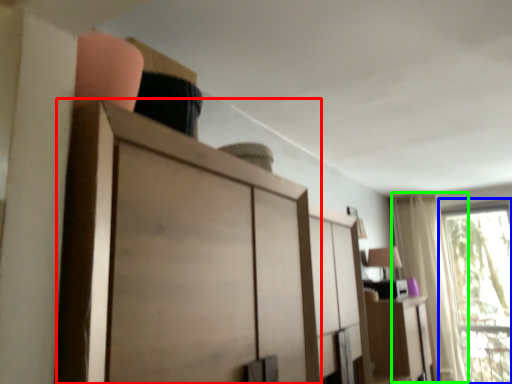
Question: Which object is the closest to the cupboard (highlighted by a red box)? Choose among these: window (highlighted by a blue box) or curtain (highlighted by a green box).

Choices:
 (A) window
 (B) curtain

Answer: (B)